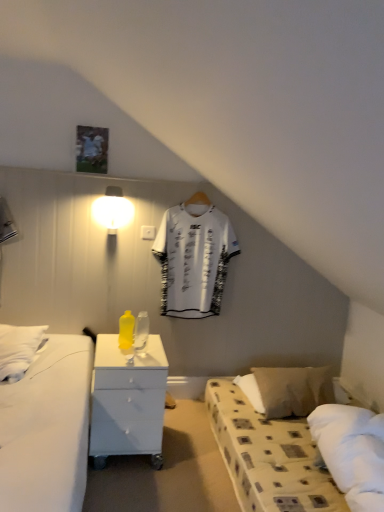
Question: Is beige fabric pillow at lower right at the back of yellow matte bottle at center, which appears as the second bottle when viewed from the right?

Choices:
 (A) no
 (B) yes

Answer: (A)

Question: Is yellow matte bottle at center, which appears as the second bottle when viewed from the right, behind beige fabric pillow at lower right?

Choices:
 (A) yes
 (B) no

Answer: (B)

Question: From a real-world perspective, is yellow matte bottle at center, which appears as the second bottle when viewed from the right, below beige fabric pillow at lower right?

Choices:
 (A) no
 (B) yes

Answer: (A)

Question: Is the surface of yellow matte bottle at center, marked as the 1th bottle in a left-to-right arrangement, in direct contact with beige fabric pillow at lower right?

Choices:
 (A) no
 (B) yes

Answer: (A)

Question: Can you confirm if yellow matte bottle at center, marked as the 1th bottle in a left-to-right arrangement, is positioned to the left of beige fabric pillow at lower right?

Choices:
 (A) no
 (B) yes

Answer: (B)

Question: Is white jersey at center inside the boundaries of white glossy nightstand at center, or outside?

Choices:
 (A) outside
 (B) inside

Answer: (A)

Question: Is white jersey at center taller or shorter than white glossy nightstand at center?

Choices:
 (A) short
 (B) tall

Answer: (B)

Question: Considering their positions, is white jersey at center located in front of or behind white glossy nightstand at center?

Choices:
 (A) behind
 (B) front

Answer: (A)

Question: From a real-world perspective, relative to white glossy nightstand at center, is white jersey at center vertically above or below?

Choices:
 (A) above
 (B) below

Answer: (A)

Question: Looking at their shapes, would you say transparent glass bottle at center, acting as the 1th bottle starting from the right, is wider or thinner than white jersey at center?

Choices:
 (A) wide
 (B) thin

Answer: (A)

Question: Is transparent glass bottle at center, marked as the 2th bottle in a left-to-right arrangement, bigger or smaller than white jersey at center?

Choices:
 (A) small
 (B) big

Answer: (A)

Question: From a real-world perspective, is transparent glass bottle at center, acting as the 1th bottle starting from the right, above or below white jersey at center?

Choices:
 (A) above
 (B) below

Answer: (B)

Question: Based on their positions, is transparent glass bottle at center, acting as the 1th bottle starting from the right, located to the left or right of white jersey at center?

Choices:
 (A) right
 (B) left

Answer: (B)

Question: In the image, is beige fabric pillow at lower right on the left side or the right side of transparent glass bottle at center, marked as the 2th bottle in a left-to-right arrangement?

Choices:
 (A) left
 (B) right

Answer: (B)

Question: Is beige fabric pillow at lower right situated inside transparent glass bottle at center, acting as the 1th bottle starting from the right, or outside?

Choices:
 (A) outside
 (B) inside

Answer: (A)